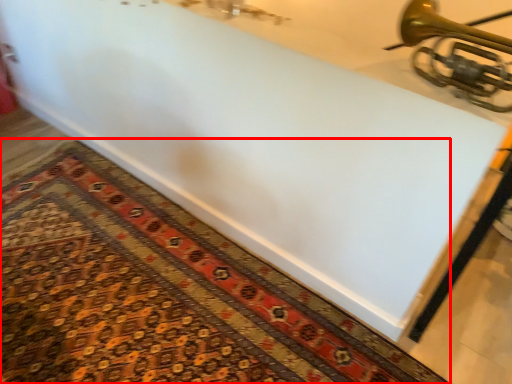
Question: From the image's perspective, where is mat (annotated by the red box) located relative to musical instrument?

Choices:
 (A) above
 (B) below

Answer: (B)